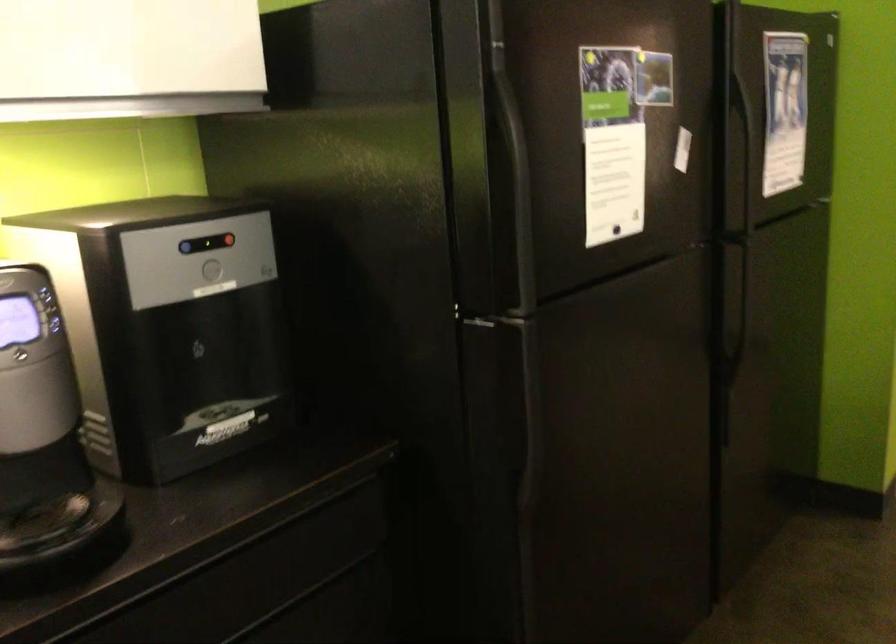
I want to click on red dispenser button, so click(227, 240).